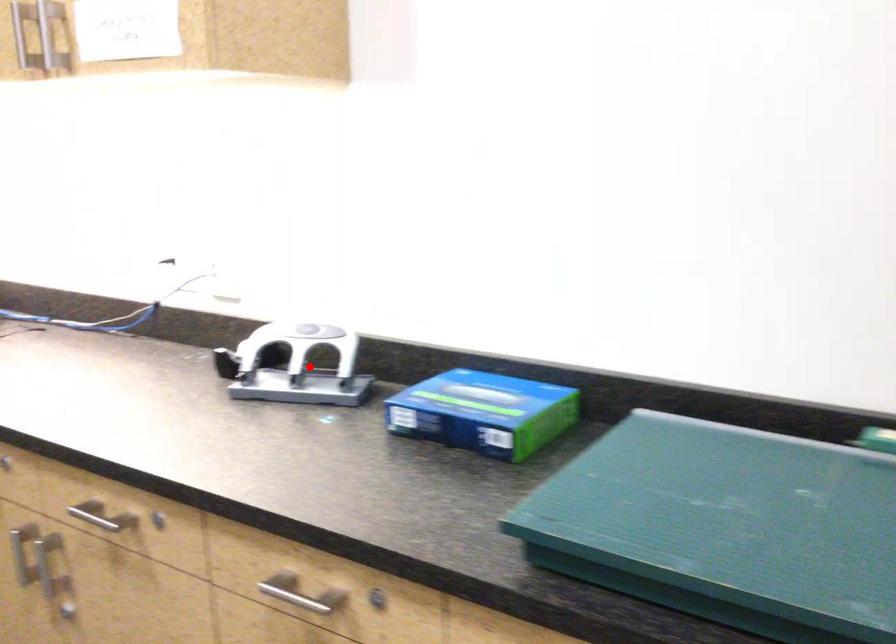
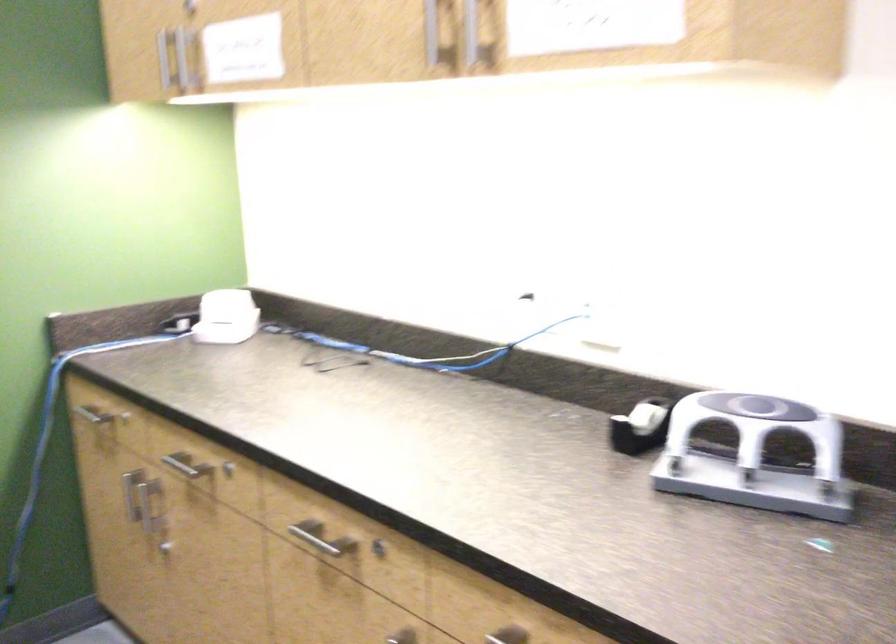
Locate, in the second image, the point that corresponds to the highlighted location in the first image.

(755, 456)